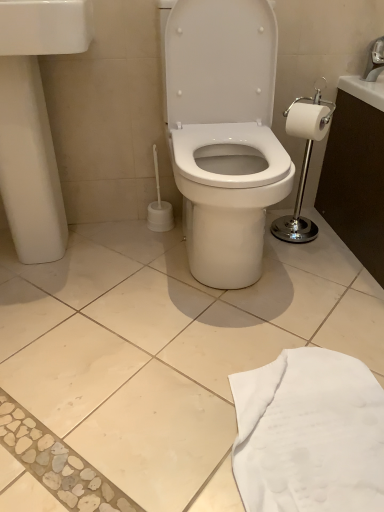
Question: From the image's perspective, is white glossy toilet paper at right under silver metallic faucet at upper right?

Choices:
 (A) yes
 (B) no

Answer: (A)

Question: Is white glossy toilet paper at right positioned with its back to silver metallic faucet at upper right?

Choices:
 (A) yes
 (B) no

Answer: (A)

Question: Is white glossy toilet paper at right closer to the viewer compared to silver metallic faucet at upper right?

Choices:
 (A) no
 (B) yes

Answer: (B)

Question: Is white glossy toilet paper at right with silver metallic faucet at upper right?

Choices:
 (A) no
 (B) yes

Answer: (A)

Question: Considering the relative sizes of white glossy toilet paper at right and silver metallic faucet at upper right in the image provided, is white glossy toilet paper at right thinner than silver metallic faucet at upper right?

Choices:
 (A) yes
 (B) no

Answer: (A)

Question: From a real-world perspective, is white glossy toilet paper at right physically above silver metallic faucet at upper right?

Choices:
 (A) no
 (B) yes

Answer: (A)

Question: From the image's perspective, is white glossy toilet paper at right located above white fabric at lower right?

Choices:
 (A) no
 (B) yes

Answer: (B)

Question: Considering the relative positions of white glossy toilet paper at right and white fabric at lower right in the image provided, is white glossy toilet paper at right to the left of white fabric at lower right from the viewer's perspective?

Choices:
 (A) yes
 (B) no

Answer: (B)

Question: Is white glossy toilet paper at right directly adjacent to white fabric at lower right?

Choices:
 (A) yes
 (B) no

Answer: (B)

Question: Is white glossy toilet paper at right taller than white fabric at lower right?

Choices:
 (A) yes
 (B) no

Answer: (A)

Question: Does white glossy toilet paper at right come behind white fabric at lower right?

Choices:
 (A) yes
 (B) no

Answer: (A)

Question: Would you say white glossy toilet paper at right is a long distance from white fabric at lower right?

Choices:
 (A) no
 (B) yes

Answer: (A)

Question: Is white glossy sink at left at the back of white glossy toilet paper at right?

Choices:
 (A) yes
 (B) no

Answer: (B)